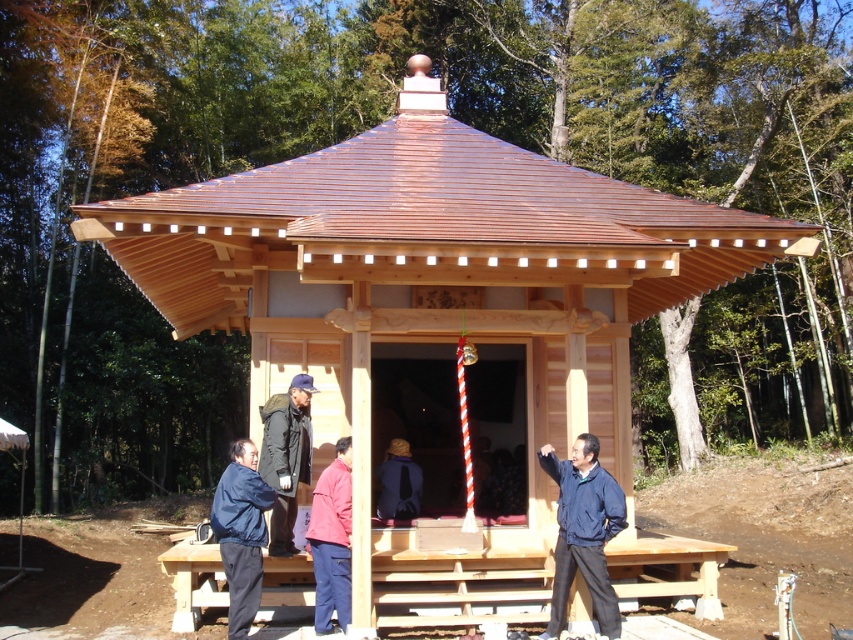
Question: Is dark blue jacket at center wider than reddish-brown wooden person at center?

Choices:
 (A) yes
 (B) no

Answer: (B)

Question: Does blue fabric jacket at lower left have a greater width compared to dark blue jacket at center?

Choices:
 (A) no
 (B) yes

Answer: (A)

Question: Which object is the closest to the blue fabric jacket at lower left?

Choices:
 (A) red fabric jacket at center
 (B) dark blue jacket at center

Answer: (A)

Question: Estimate the real-world distances between objects in this image. Which object is farther from the blue fabric jacket at lower left?

Choices:
 (A) dark blue jacket at center
 (B) red fabric jacket at center
 (C) reddish-brown wooden person at center

Answer: (C)

Question: Is dark blue jacket at center bigger than reddish-brown wooden person at center?

Choices:
 (A) yes
 (B) no

Answer: (A)

Question: Which point appears closest to the camera in this image?

Choices:
 (A) (244, 556)
 (B) (325, 532)
 (C) (265, 468)
 (D) (404, 468)

Answer: (A)